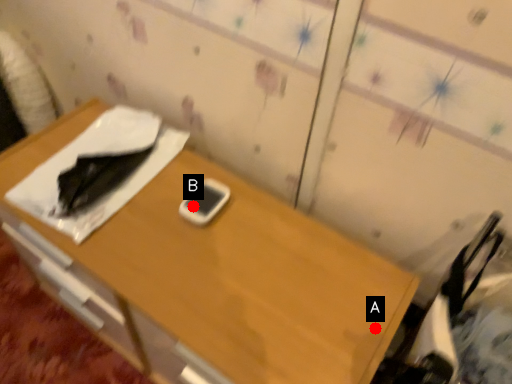
Question: Two points are circled on the image, labeled by A and B beside each circle. Which point appears closest to the camera in this image?

Choices:
 (A) A is closer
 (B) B is closer

Answer: (A)